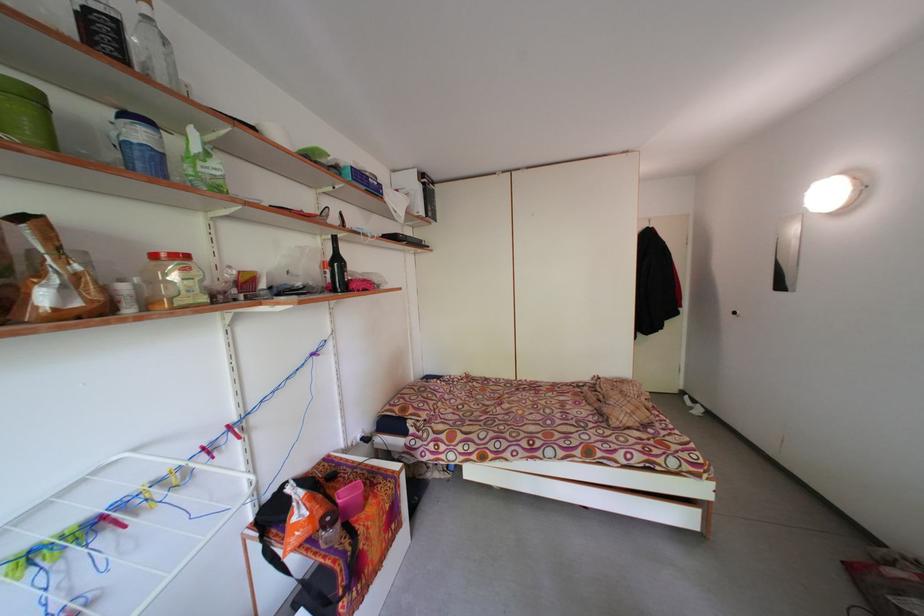
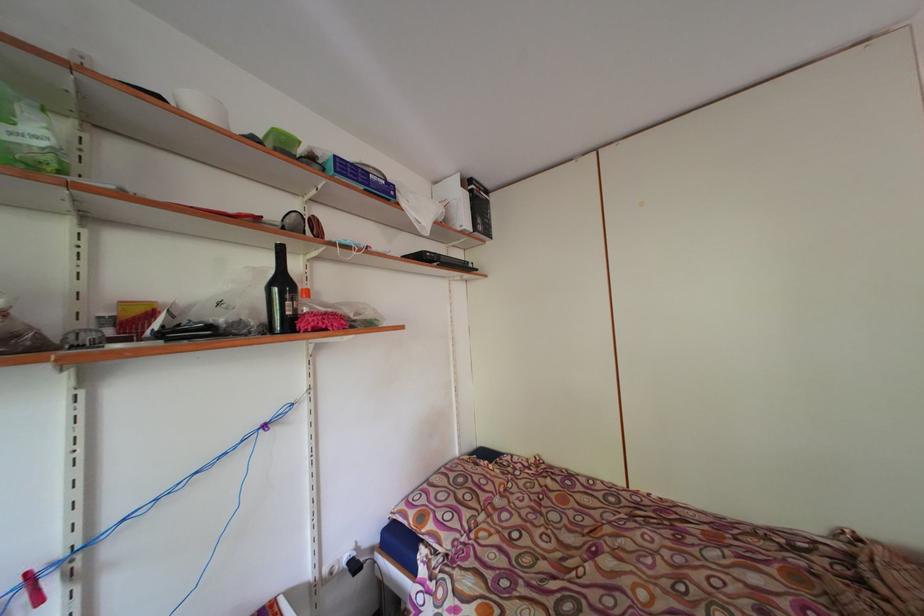
Where in the second image is the point corresponding to the point at 333,222 from the first image?

(296, 227)